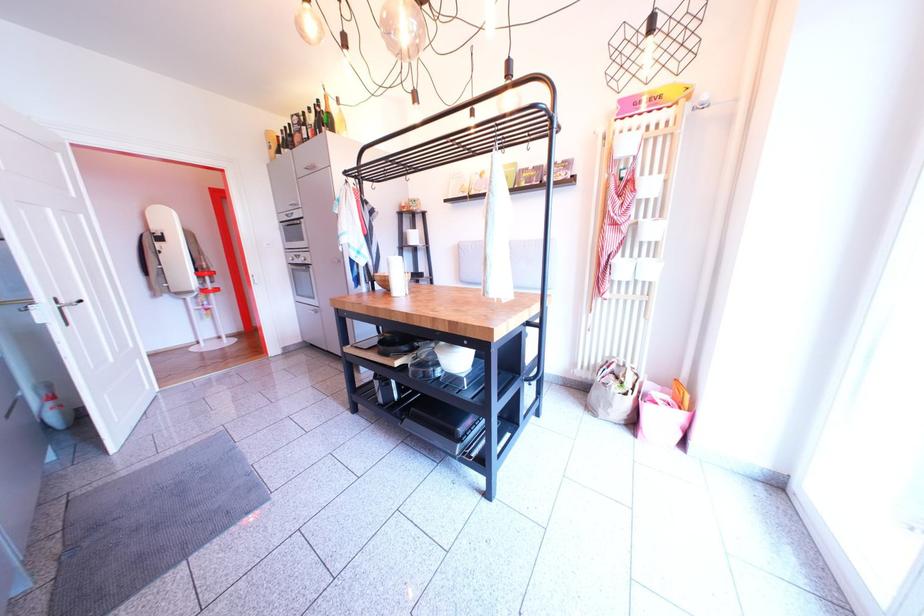
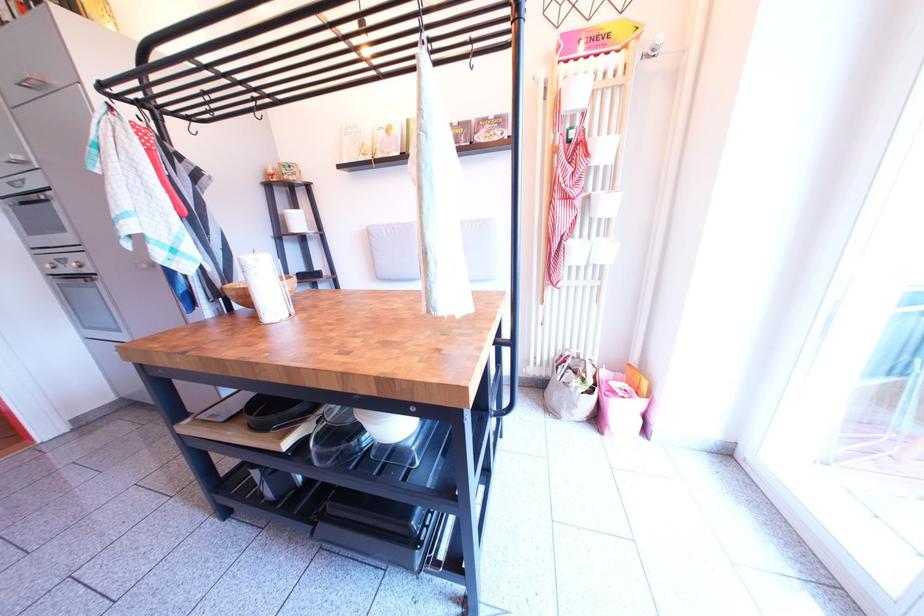
Find the pixel in the second image that matches point (418, 240) in the first image.

(295, 222)